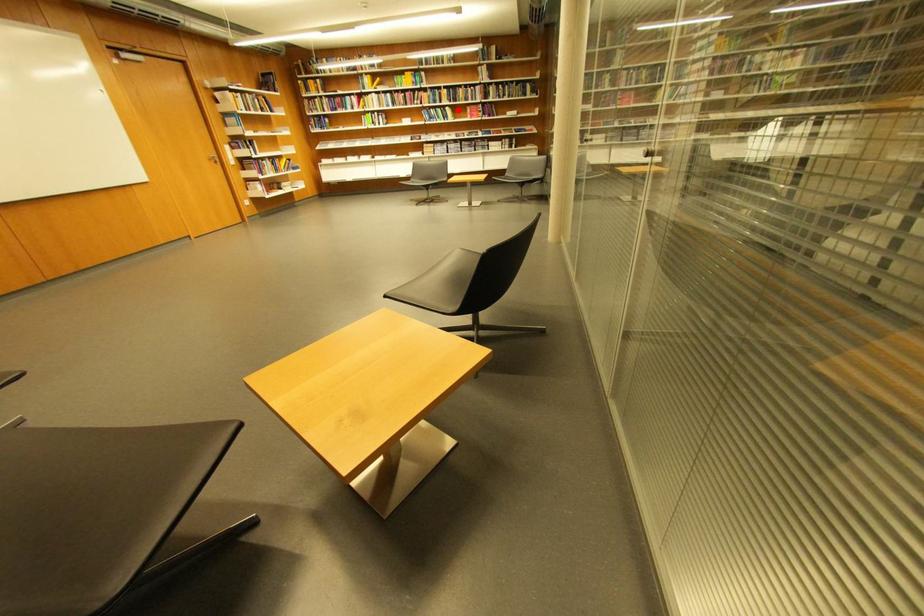
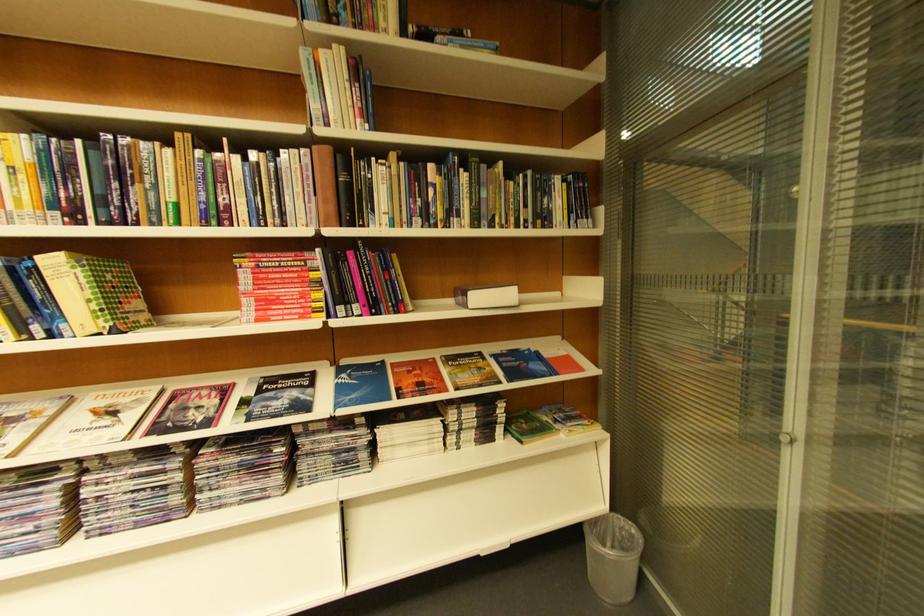
Question: I am providing you with two images of the same scene from different viewpoints. In image1, a red point is highlighted. Considering the same 3D point in image2, which of the following is correct?

Choices:
 (A) It is closer
 (B) It is farther

Answer: (B)